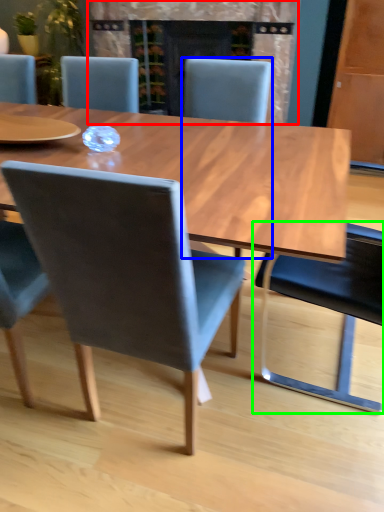
Question: Which object is the farthest from fireplace (highlighted by a red box)? Choose among these: chair (highlighted by a blue box) or chair (highlighted by a green box).

Choices:
 (A) chair
 (B) chair

Answer: (B)